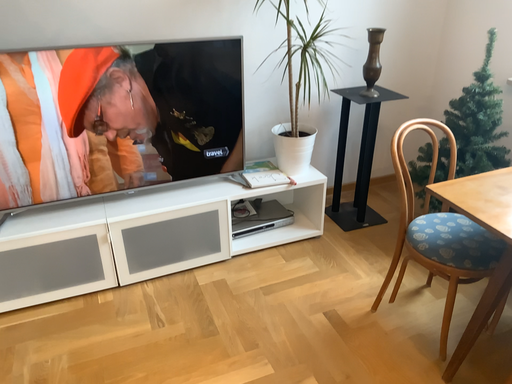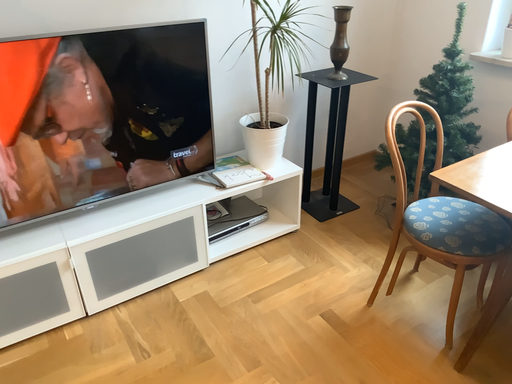
Question: Which way did the camera rotate in the video?

Choices:
 (A) rotated left
 (B) rotated right

Answer: (B)